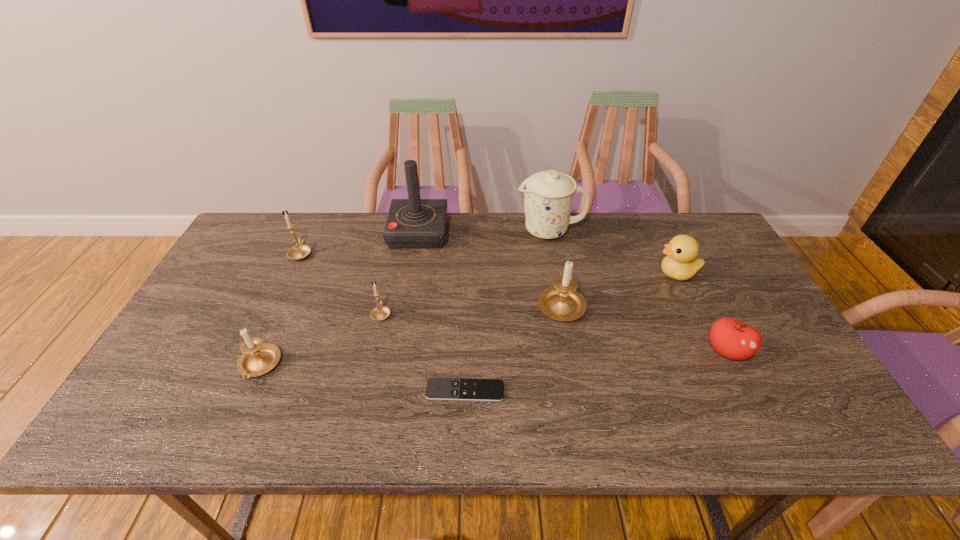
Where is `vacant point located between the second candle holder from right to left and the nearer beige candle holder`? Image resolution: width=960 pixels, height=540 pixels. vacant point located between the second candle holder from right to left and the nearer beige candle holder is located at coordinates (321, 340).

Identify which object is the second nearest to the farther beige candle holder. Please provide its 2D coordinates. Your answer should be formatted as a tuple, i.e. [(x, y)], where the tuple contains the x and y coordinates of a point satisfying the conditions above.

[(437, 388)]

Point out which object is positioned as the third nearest to the chinaware. Please provide its 2D coordinates. Your answer should be formatted as a tuple, i.e. [(x, y)], where the tuple contains the x and y coordinates of a point satisfying the conditions above.

[(413, 223)]

At what (x,y) coordinates should I click in order to perform the action: click on candle holder that is the second closest to the bigger beige candle holder. Please return your answer as a coordinate pair (x, y). The image size is (960, 540). Looking at the image, I should click on (258, 358).

Choose which candle holder is the fourth nearest neighbor to the joystick. Please provide its 2D coordinates. Your answer should be formatted as a tuple, i.e. [(x, y)], where the tuple contains the x and y coordinates of a point satisfying the conditions above.

[(258, 358)]

The width and height of the screenshot is (960, 540). I want to click on blank area in the image that satisfies the following two spatial constraints: 1. on the face of the duck; 2. with a handle on the side of the smaller beige candle holder, so click(721, 366).

I want to click on vacant space that satisfies the following two spatial constraints: 1. on the spout of the chinaware; 2. on the back side of the red apple, so click(x=572, y=352).

Where is `free space that satisfies the following two spatial constraints: 1. on the rectangular base of the joystick; 2. on the back side of the remote control`? free space that satisfies the following two spatial constraints: 1. on the rectangular base of the joystick; 2. on the back side of the remote control is located at coordinates (392, 390).

In order to click on vacant region that satisfies the following two spatial constraints: 1. on the face of the yellow duck; 2. on the right side of the red apple in this screenshot , I will do `click(714, 352)`.